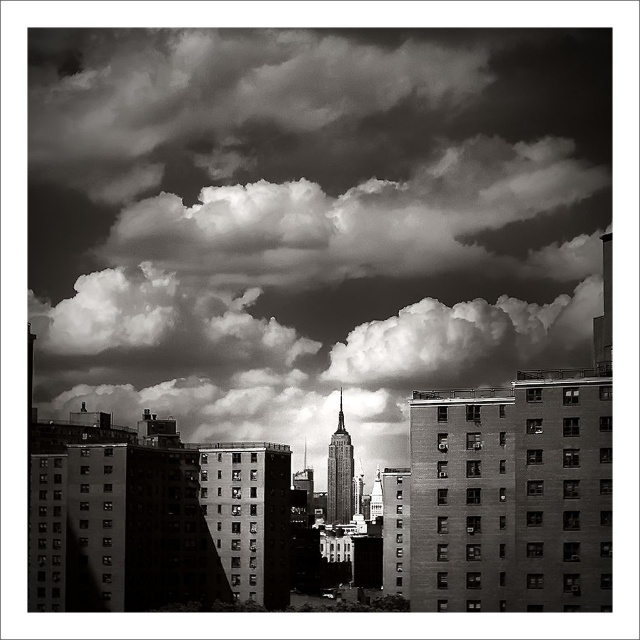
Question: Is cloudy sky at upper center above smooth glass skyscraper at center?

Choices:
 (A) yes
 (B) no

Answer: (A)

Question: Which point appears closest to the camera in this image?

Choices:
 (A) (36, 202)
 (B) (332, 483)

Answer: (B)

Question: Which point is farther from the camera taking this photo?

Choices:
 (A) (74, 102)
 (B) (349, 454)

Answer: (A)

Question: Does cloudy sky at upper center appear on the left side of smooth glass skyscraper at center?

Choices:
 (A) no
 (B) yes

Answer: (B)

Question: Observing the image, what is the correct spatial positioning of cloudy sky at upper center in reference to smooth glass skyscraper at center?

Choices:
 (A) below
 (B) above

Answer: (B)